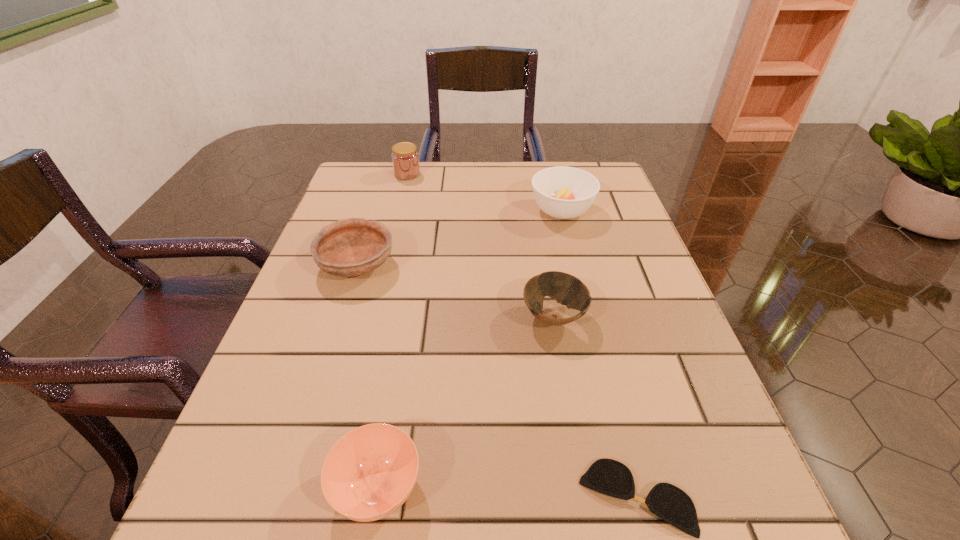
The height and width of the screenshot is (540, 960). I want to click on jam, so click(x=405, y=158).

Where is `the second farthest object`? The width and height of the screenshot is (960, 540). the second farthest object is located at coordinates (562, 192).

The height and width of the screenshot is (540, 960). Find the location of `the farther soup bowl`. the farther soup bowl is located at coordinates (562, 192).

You are a GUI agent. You are given a task and a screenshot of the screen. Output one action in this format:
    pyautogui.click(x=<x>, y=<y>)
    Task: Click on the left bowl
    This screenshot has height=540, width=960.
    Given the screenshot: What is the action you would take?
    pyautogui.click(x=349, y=247)

I want to click on the farther bowl, so click(349, 247).

Locate an element on the screen. The height and width of the screenshot is (540, 960). the nearer bowl is located at coordinates (568, 290).

Image resolution: width=960 pixels, height=540 pixels. Identify the location of the right bowl. (568, 290).

The image size is (960, 540). I want to click on the left soup bowl, so click(369, 473).

I want to click on the nearer soup bowl, so (369, 473).

This screenshot has width=960, height=540. I want to click on spectacles, so click(610, 477).